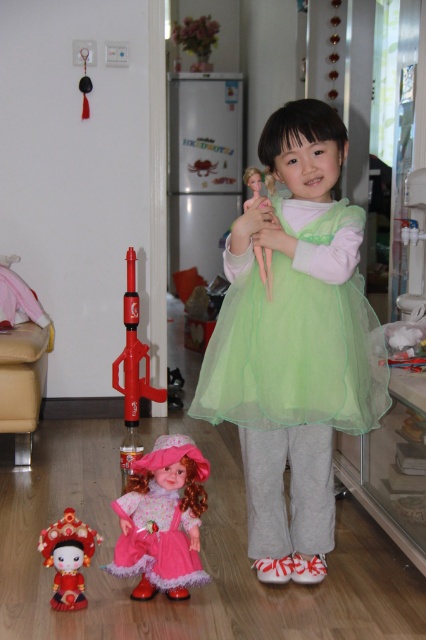
Question: From the image, what is the correct spatial relationship of green tulle dress at center in relation to smooth plastic doll at center?

Choices:
 (A) above
 (B) below

Answer: (B)

Question: Which point is closer to the camera taking this photo?

Choices:
 (A) (124, 416)
 (B) (51, 557)

Answer: (B)

Question: Can you confirm if green tulle dress at center is smaller than rubberized red toy gun at center?

Choices:
 (A) yes
 (B) no

Answer: (A)

Question: Is pink fabric doll at lower center further to the viewer compared to smooth plastic doll at center?

Choices:
 (A) yes
 (B) no

Answer: (A)

Question: Which object is the closest to the green tulle dress at center?

Choices:
 (A) pink fabric doll at lower center
 (B) matte red doll at lower left

Answer: (A)

Question: Considering the real-world distances, which object is closest to the pink fabric doll at lower center?

Choices:
 (A) rubberized red toy gun at center
 (B) smooth plastic doll at center
 (C) matte red doll at lower left
 (D) green tulle dress at center

Answer: (C)